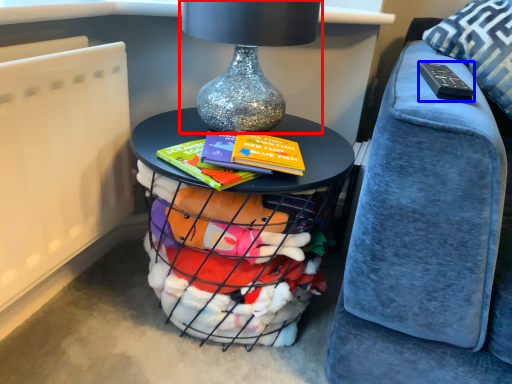
Question: Which object is closer to the camera taking this photo, table lamp (highlighted by a red box) or remote (highlighted by a blue box)?

Choices:
 (A) table lamp
 (B) remote

Answer: (B)